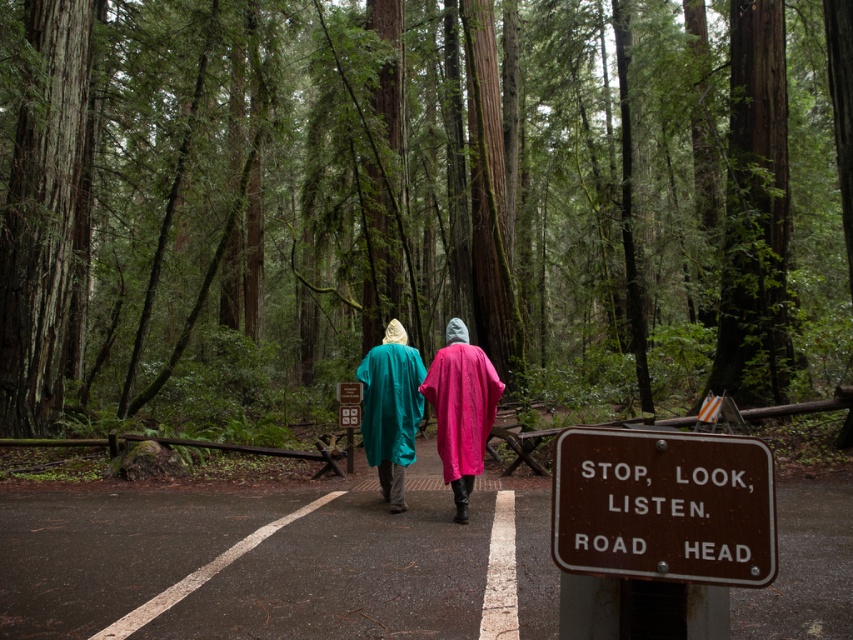
Question: Does pink fabric robe at center appear on the left side of matte teal robe at center?

Choices:
 (A) yes
 (B) no

Answer: (B)

Question: Is green matte rain poncho at center positioned at the back of pink fabric robe at center?

Choices:
 (A) yes
 (B) no

Answer: (A)

Question: Which object is the farthest from the teal matte poncho at center?

Choices:
 (A) pink fabric robe at center
 (B) green matte rain poncho at center
 (C) matte teal robe at center

Answer: (B)

Question: Can you confirm if brown metallic sign at lower right is bigger than matte teal robe at center?

Choices:
 (A) yes
 (B) no

Answer: (B)

Question: Which is farther from the pink fabric robe at center?

Choices:
 (A) brown metallic sign at lower right
 (B) teal matte poncho at center

Answer: (A)

Question: Which of the following is the farthest from the observer?

Choices:
 (A) matte teal robe at center
 (B) pink fabric robe at center
 (C) teal matte poncho at center
 (D) brown metallic sign at lower right

Answer: (A)